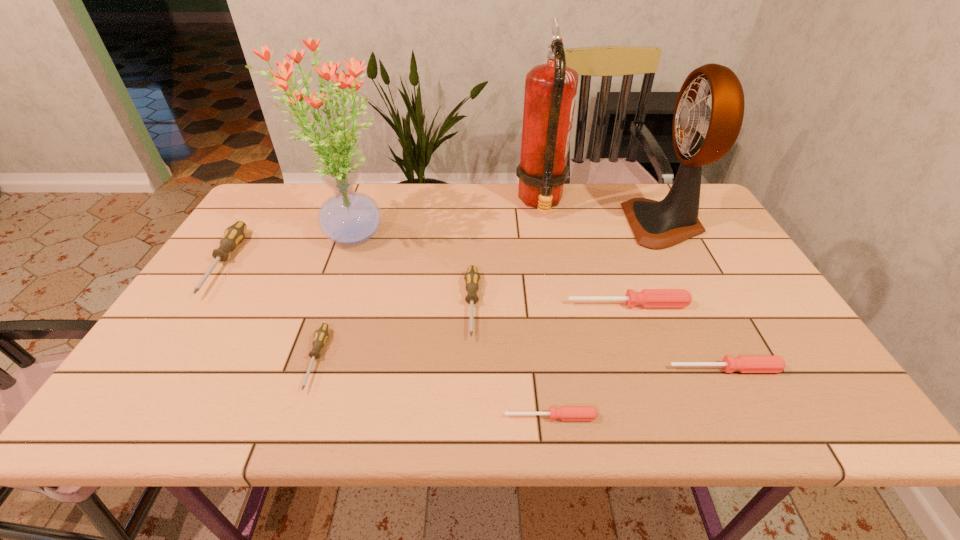
Locate an element on the screen. This screenshot has width=960, height=540. blank space that satisfies the following two spatial constraints: 1. at the nozzle of the red fire extinguisher; 2. at the tip of the leftmost gray screwdriver is located at coordinates (552, 263).

At what (x,y) coordinates should I click in order to perform the action: click on vacant region that satisfies the following two spatial constraints: 1. on the front-facing side of the fan; 2. at the tip of the sixth shortest object. Please return your answer as a coordinate pair (x, y). This screenshot has height=540, width=960. Looking at the image, I should click on (684, 263).